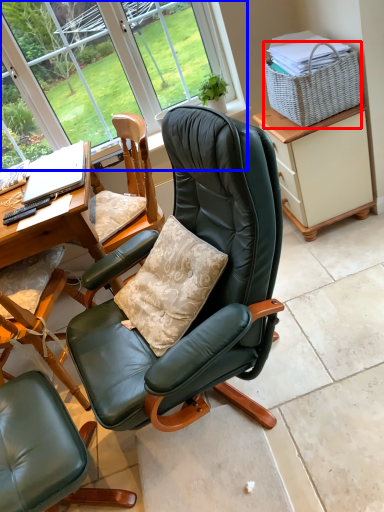
Question: Which object is further to the camera taking this photo, picnic basket (highlighted by a red box) or bay window (highlighted by a blue box)?

Choices:
 (A) picnic basket
 (B) bay window

Answer: (B)